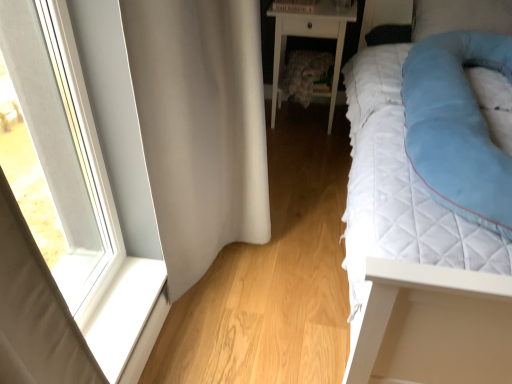
Question: Does blue soft pillow at upper right have a lesser height compared to clear glass window at left?

Choices:
 (A) no
 (B) yes

Answer: (B)

Question: Does blue soft pillow at upper right have a greater height compared to clear glass window at left?

Choices:
 (A) no
 (B) yes

Answer: (A)

Question: Considering the relative positions of blue soft pillow at upper right and clear glass window at left in the image provided, is blue soft pillow at upper right in front of clear glass window at left?

Choices:
 (A) no
 (B) yes

Answer: (A)

Question: Considering the relative sizes of blue soft pillow at upper right and clear glass window at left in the image provided, is blue soft pillow at upper right wider than clear glass window at left?

Choices:
 (A) yes
 (B) no

Answer: (A)

Question: Is blue soft pillow at upper right behind clear glass window at left?

Choices:
 (A) yes
 (B) no

Answer: (A)

Question: Can you confirm if blue soft pillow at upper right is smaller than clear glass window at left?

Choices:
 (A) no
 (B) yes

Answer: (A)

Question: Does white glossy nightstand at center have a lesser height compared to white quilted bed at right?

Choices:
 (A) no
 (B) yes

Answer: (B)

Question: Is white glossy nightstand at center thinner than white quilted bed at right?

Choices:
 (A) no
 (B) yes

Answer: (B)

Question: Considering the relative sizes of white glossy nightstand at center and white quilted bed at right in the image provided, is white glossy nightstand at center smaller than white quilted bed at right?

Choices:
 (A) no
 (B) yes

Answer: (B)

Question: From a real-world perspective, is white glossy nightstand at center under white quilted bed at right?

Choices:
 (A) no
 (B) yes

Answer: (B)

Question: Can you confirm if white glossy nightstand at center is positioned to the right of white quilted bed at right?

Choices:
 (A) no
 (B) yes

Answer: (A)

Question: Does white glossy nightstand at center have a greater width compared to white quilted bed at right?

Choices:
 (A) yes
 (B) no

Answer: (B)

Question: From a real-world perspective, is clear glass window at left located beneath light blue quilted pillow at right?

Choices:
 (A) no
 (B) yes

Answer: (B)